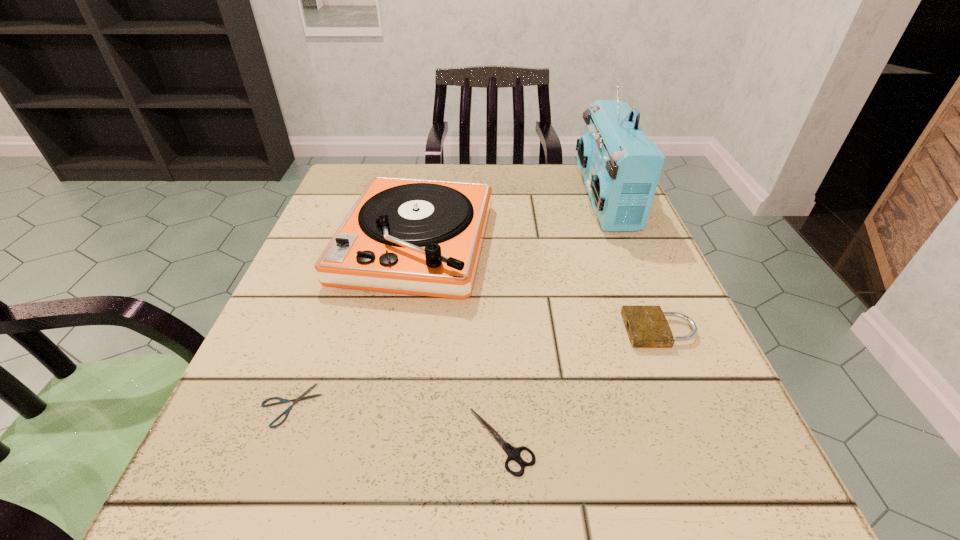
Find the location of `the tallest object`. the tallest object is located at coordinates (621, 167).

The width and height of the screenshot is (960, 540). In order to click on the second tallest object in this screenshot , I will do `click(421, 237)`.

Identify the location of padlock. (647, 327).

This screenshot has width=960, height=540. I want to click on the third shortest object, so click(x=647, y=327).

Identify the location of the taller shears. (513, 453).

You are a GUI agent. You are given a task and a screenshot of the screen. Output one action in this format:
    pyautogui.click(x=<x>, y=<y>)
    Task: Click on the right shears
    The width and height of the screenshot is (960, 540).
    Given the screenshot: What is the action you would take?
    pyautogui.click(x=513, y=453)

Locate an element on the screen. the shortest object is located at coordinates (300, 398).

The width and height of the screenshot is (960, 540). I want to click on the shorter shears, so click(x=300, y=398).

This screenshot has width=960, height=540. Find the location of `vacant space located 0.270m on the front-facing side of the tallest object`. vacant space located 0.270m on the front-facing side of the tallest object is located at coordinates (466, 198).

Where is `free space located on the front-facing side of the tallest object`? The height and width of the screenshot is (540, 960). free space located on the front-facing side of the tallest object is located at coordinates (466, 198).